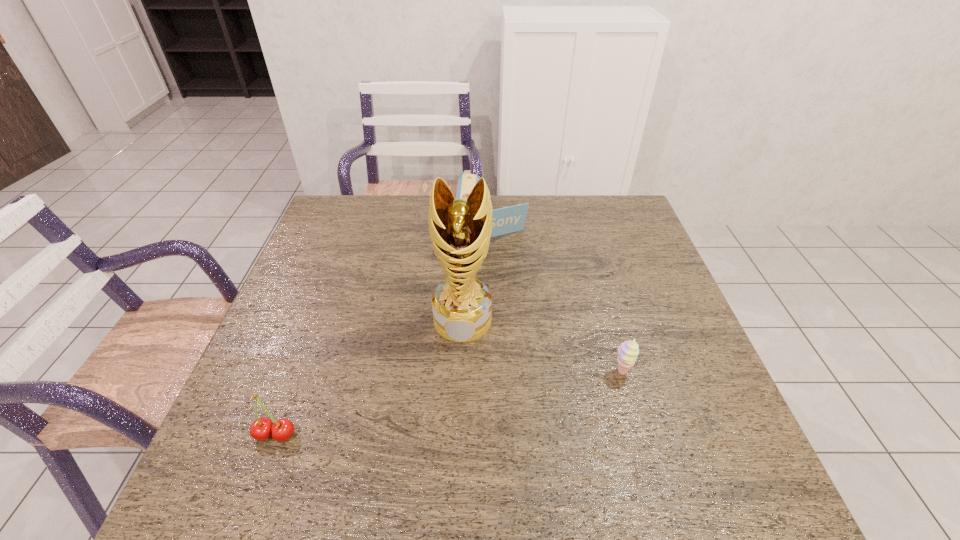
Image resolution: width=960 pixels, height=540 pixels. I want to click on vacant area located 0.260m on the side of the camcorder with the flip-out screen, so click(490, 329).

The image size is (960, 540). Find the location of `vacant area situated on the side of the camcorder with the flip-out screen`. vacant area situated on the side of the camcorder with the flip-out screen is located at coordinates (489, 332).

Locate an element on the screen. The width and height of the screenshot is (960, 540). free space located 0.110m on the front-facing side of the tallest object is located at coordinates (456, 381).

Image resolution: width=960 pixels, height=540 pixels. I want to click on vacant area situated 0.190m on the front-facing side of the tallest object, so click(452, 414).

Where is `vacant space situated on the front-facing side of the tallest object`? vacant space situated on the front-facing side of the tallest object is located at coordinates click(450, 431).

Locate an element on the screen. This screenshot has width=960, height=540. object that is at the far edge is located at coordinates (505, 220).

In order to click on object situated at the near edge in this screenshot , I will do `click(261, 429)`.

You are a GUI agent. You are given a task and a screenshot of the screen. Output one action in this format:
    pyautogui.click(x=<x>, y=<y>)
    Task: Click on the object present at the left edge
    
    Given the screenshot: What is the action you would take?
    pyautogui.click(x=261, y=429)

Where is `object positioned at the near left corner`? object positioned at the near left corner is located at coordinates (261, 429).

Image resolution: width=960 pixels, height=540 pixels. What are the coordinates of `vacant space at the far edge of the desktop` in the screenshot? It's located at (542, 198).